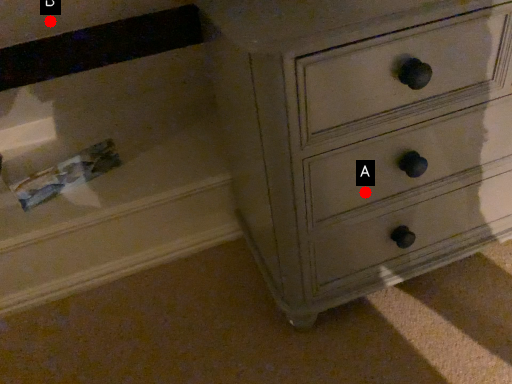
Question: Two points are circled on the image, labeled by A and B beside each circle. Among these points, which one is nearest to the camera?

Choices:
 (A) A is closer
 (B) B is closer

Answer: (A)